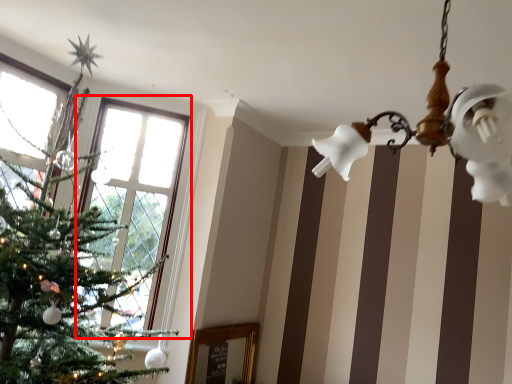
Question: From the image, what is the correct spatial relationship of window (annotated by the red box) in relation to light fixture?

Choices:
 (A) right
 (B) left

Answer: (B)